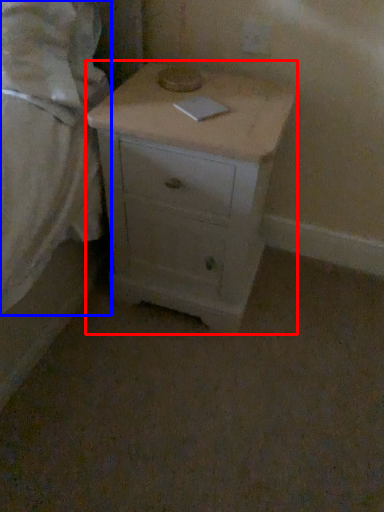
Question: Which object is further to the camera taking this photo, chest of drawers (highlighted by a red box) or bed (highlighted by a blue box)?

Choices:
 (A) chest of drawers
 (B) bed

Answer: (A)